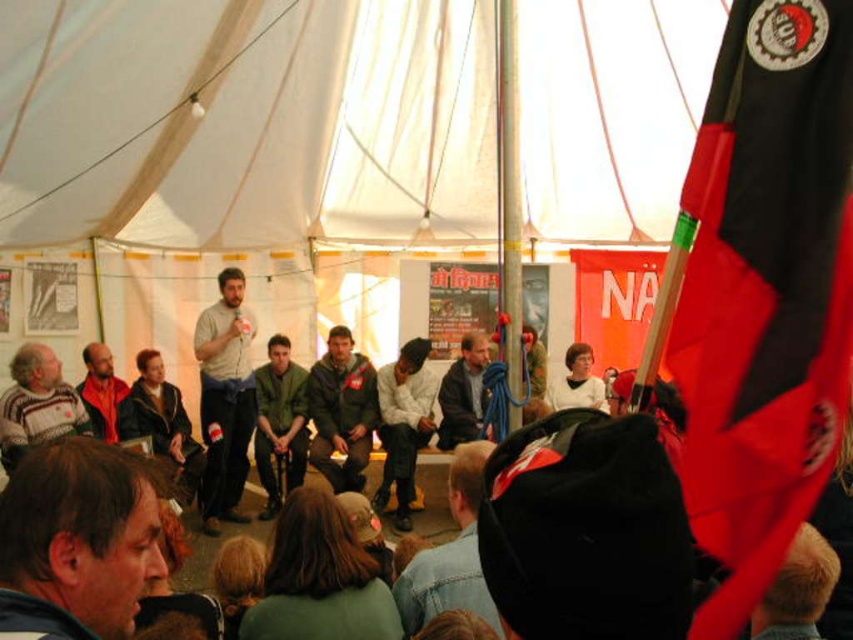
Consider the image. Can you confirm if brown hair at center is wider than light gray cotton shirt at center?

Correct, the width of brown hair at center exceeds that of light gray cotton shirt at center.

Is point (96, 513) positioned before point (218, 285)?

Yes.

This screenshot has width=853, height=640. What do you see at coordinates (76, 540) in the screenshot? I see `brown hair at center` at bounding box center [76, 540].

Identify the location of brown hair at center. This screenshot has height=640, width=853. (76, 540).

Does blackflag at right have a lesser width compared to brown hair at center?

Yes.

Is blackflag at right shorter than brown hair at center?

Correct, blackflag at right is not as tall as brown hair at center.

Does point (804, 394) lie in front of point (125, 611)?

That is False.

Locate an element on the screen. The height and width of the screenshot is (640, 853). blackflag at right is located at coordinates coord(764,292).

Does brown hair at center have a lesser width compared to knitted sweater at lower left?

Correct, brown hair at center's width is less than knitted sweater at lower left's.

How distant is brown hair at center from knitted sweater at lower left?

They are 11.56 meters apart.

Image resolution: width=853 pixels, height=640 pixels. Describe the element at coordinates (76, 540) in the screenshot. I see `brown hair at center` at that location.

Identify the location of brown hair at center. (76, 540).